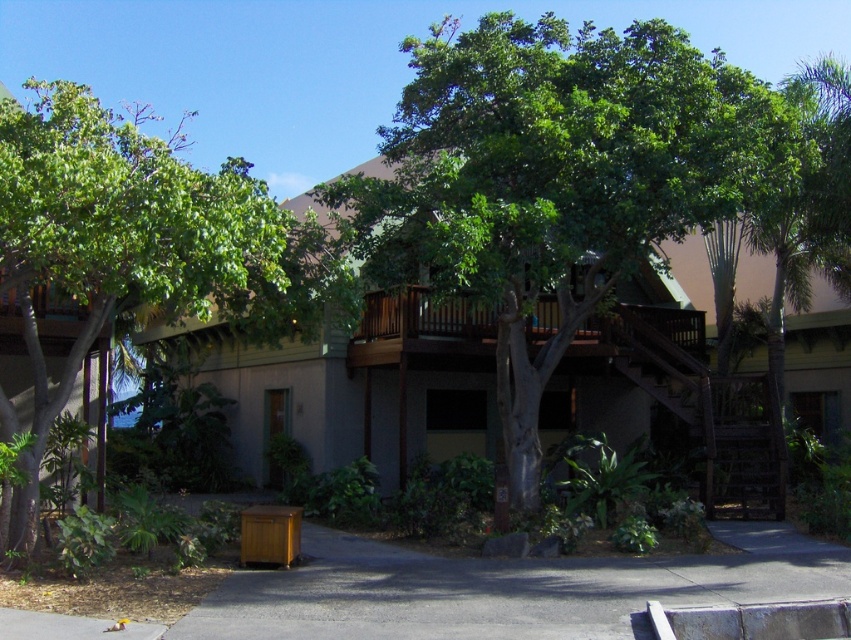
Question: Can you confirm if green leafy tree at left is wider than dark brown wooden stairs at center-right?

Choices:
 (A) yes
 (B) no

Answer: (A)

Question: Is green leafy tree at center below dark brown wooden stairs at center-right?

Choices:
 (A) yes
 (B) no

Answer: (B)

Question: Can you confirm if green leafy tree at center is smaller than dark brown wooden stairs at center-right?

Choices:
 (A) no
 (B) yes

Answer: (A)

Question: Which of the following is the closest to the observer?

Choices:
 (A) green leafy tree at left
 (B) dark brown wooden stairs at center-right

Answer: (A)

Question: Estimate the real-world distances between objects in this image. Which object is farther from the dark brown wooden stairs at center-right?

Choices:
 (A) green leafy tree at left
 (B) green leafy tree at center

Answer: (A)

Question: Estimate the real-world distances between objects in this image. Which object is farther from the green leafy tree at center?

Choices:
 (A) dark brown wooden stairs at center-right
 (B) green leafy tree at left

Answer: (B)